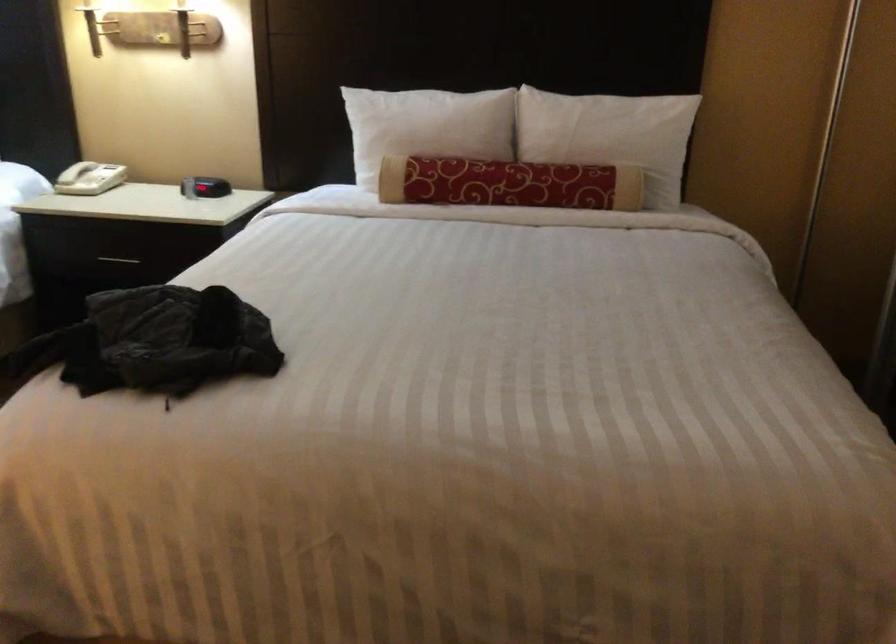
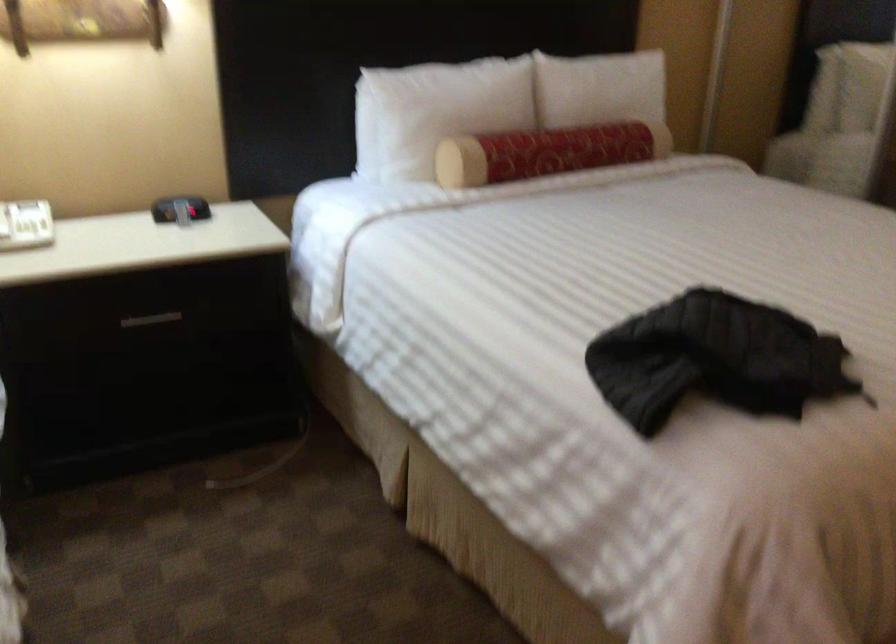
The point at (383, 129) is marked in the first image. Where is the corresponding point in the second image?

(435, 111)